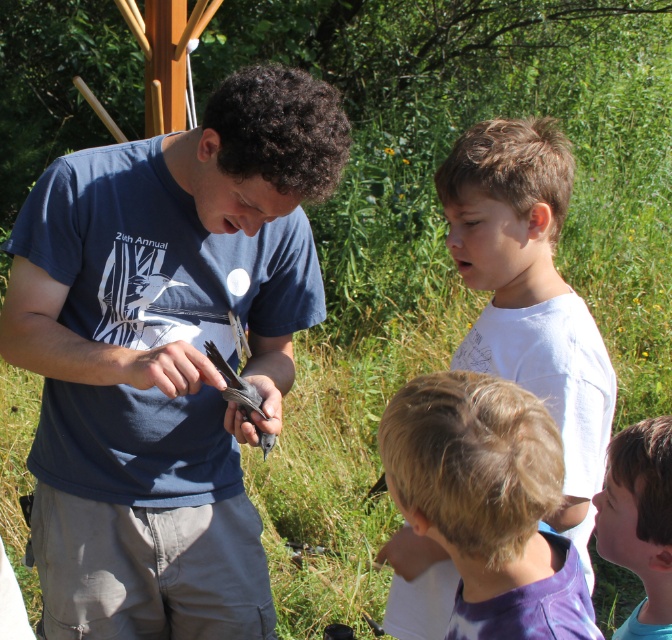
You are a photographer trying to capture a group photo of the matte blue shirt at center and the white cotton shirt at upper right. You want to ensure both shirts are visible in the frame. Given their sizes, which shirt should you focus on to include both in the composition without cropping?

Since the matte blue shirt at center is wider than the white cotton shirt at upper right, you should focus on framing the wider matte blue shirt at center first to ensure both shirts fit in the photo.

In the scene shown: You are a photographer standing at the camera position. You want to take a photo of the two points mentioned in the scene. Which point is closer to your camera, point (497, 141) or point (659, 484)?

Point (497, 141) is further to the camera than point (659, 484), so point (659, 484) is closer to the camera.